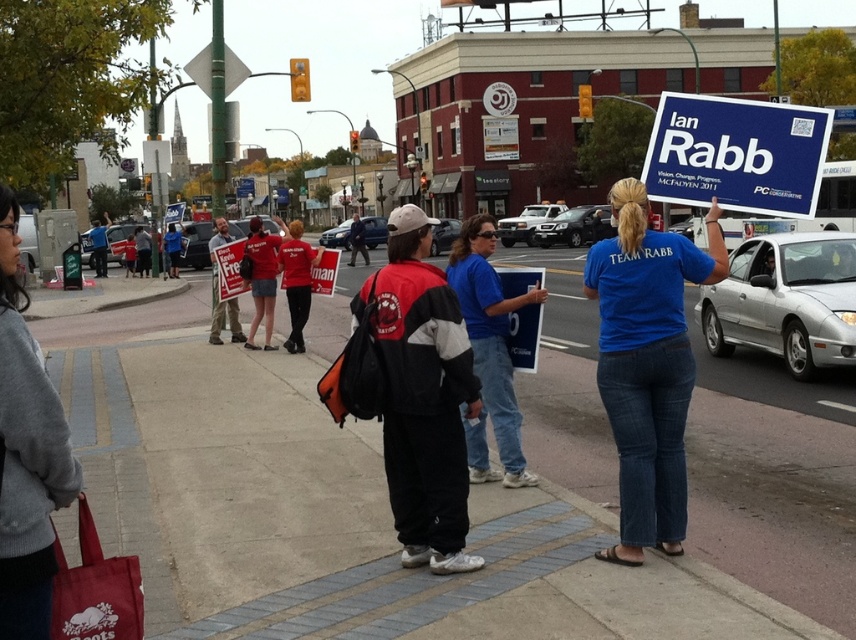
Question: Estimate the real-world distances between objects in this image. Which object is closer to the blue cardboard sign at upper right?

Choices:
 (A) concrete sidewalk at center
 (B) blue fabric sign at center
 (C) red/black jacket at center
 (D) blue cotton shirt at center

Answer: (D)

Question: Among these points, which one is farthest from the camera?

Choices:
 (A) (678, 314)
 (B) (788, 161)
 (C) (492, 234)
 (D) (456, 502)

Answer: (C)

Question: Does concrete sidewalk at center appear over blue cardboard sign at upper right?

Choices:
 (A) yes
 (B) no

Answer: (B)

Question: From the image, what is the correct spatial relationship of concrete sidewalk at center in relation to blue cardboard sign at upper right?

Choices:
 (A) right
 (B) left

Answer: (B)

Question: Is concrete sidewalk at center further to the viewer compared to blue cardboard sign at upper right?

Choices:
 (A) yes
 (B) no

Answer: (B)

Question: Which point is closer to the camera?

Choices:
 (A) blue cotton shirt at center
 (B) red/black jacket at center
 (C) blue fabric sign at center

Answer: (A)